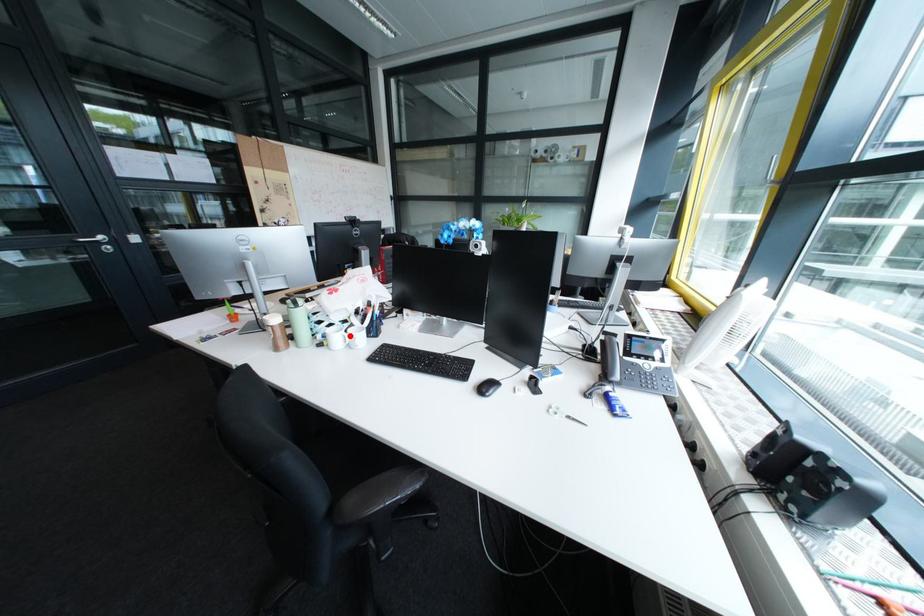
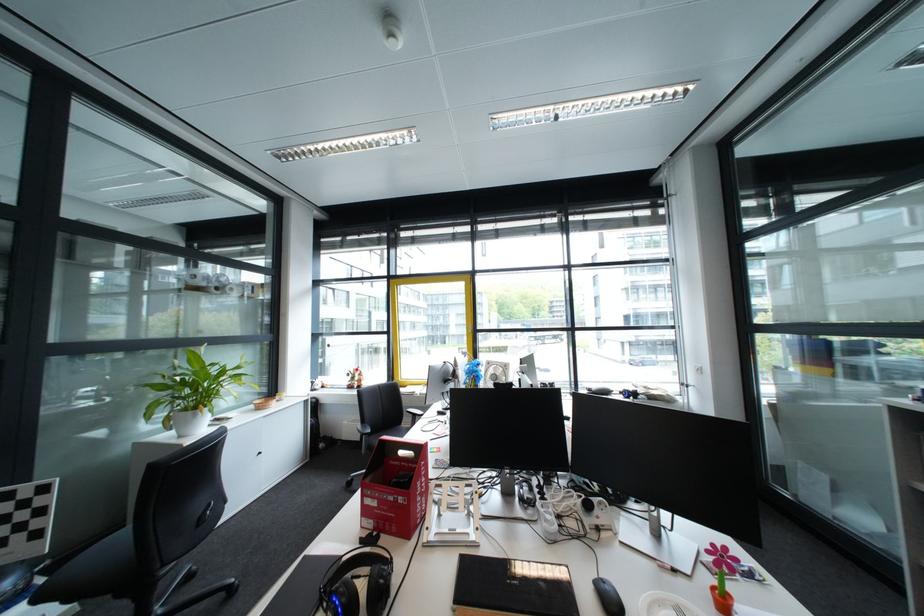
Question: I am providing you with two images of the same scene from different viewpoints. A red point is marked on the first image. Can you still see the location of the red point in image 2?

Choices:
 (A) Yes
 (B) No

Answer: (B)